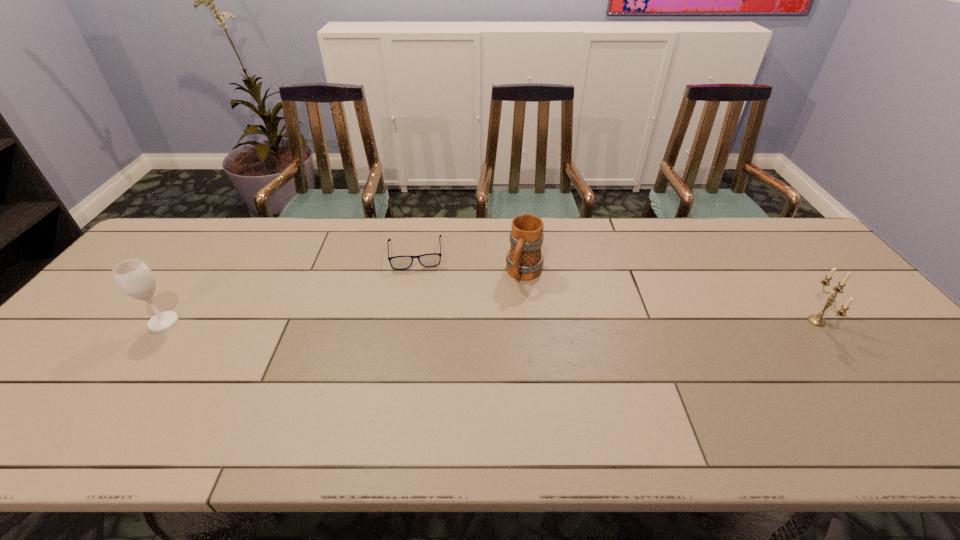
Locate an element on the screen. The width and height of the screenshot is (960, 540). the leftmost object is located at coordinates (134, 277).

This screenshot has height=540, width=960. I want to click on the rightmost object, so click(817, 320).

I want to click on the third object from left to right, so click(x=524, y=261).

This screenshot has height=540, width=960. I want to click on the third object from right to left, so click(426, 260).

Where is `the shortest object`? the shortest object is located at coordinates (426, 260).

Locate an element on the screen. Image resolution: width=960 pixels, height=540 pixels. free region located 0.300m on the right of the wineglass is located at coordinates (293, 322).

This screenshot has width=960, height=540. In order to click on blank area located 0.050m on the right of the candle in this screenshot , I will do `click(845, 321)`.

Locate an element on the screen. free region located on the side of the mug with the handle is located at coordinates (495, 336).

What are the coordinates of `vacant area situated 0.100m on the side of the mug with the handle` in the screenshot? It's located at (507, 313).

Find the location of a particular element. blank space located 0.080m on the side of the mug with the handle is located at coordinates (510, 308).